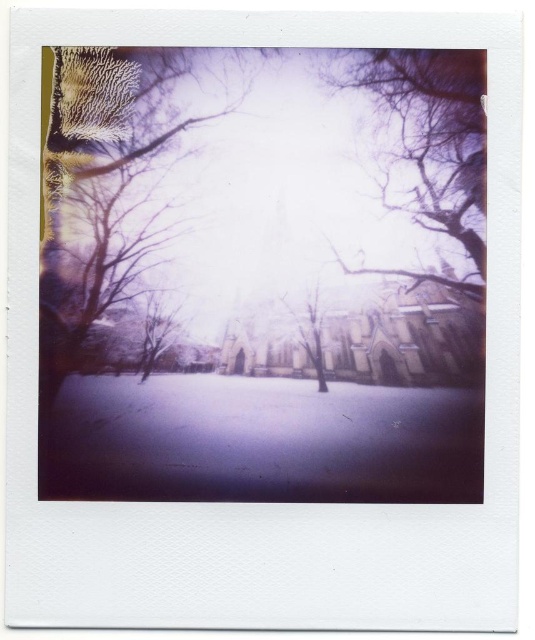
You are an artist planning to paint the snowy landscape. You want to ensure the smooth bark tree at left and the smooth brown tree at center are proportionally accurate. Which tree should you make wider in your painting?

The smooth bark tree at left should be painted wider than the smooth brown tree at center because its width surpasses the latter according to the description.

Based on the provided scene description, what object is located at the coordinates point [104,195]?

The smooth bark tree at left is located at point [104,195].

You are a photographer analyzing the composition of this Polaroid image. The scene has a snowy landscape with leafless trees. You need to determine where the translucent purple branches at upper right are located in terms of coordinates. What are their coordinates?

The translucent purple branches at upper right are located at coordinates point [435,129].